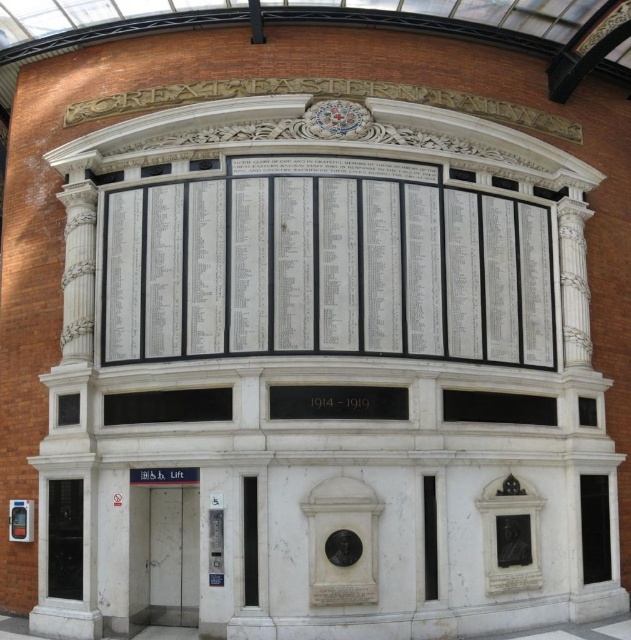
You are an architect reviewing the memorial structure. The black marble window at lower center is crucial for natural lighting. Based on its position, can you determine if it is placed on the upper or lower part of the structure?

The black marble window at lower center is located at point (167, 404), which places it in the lower part of the structure.